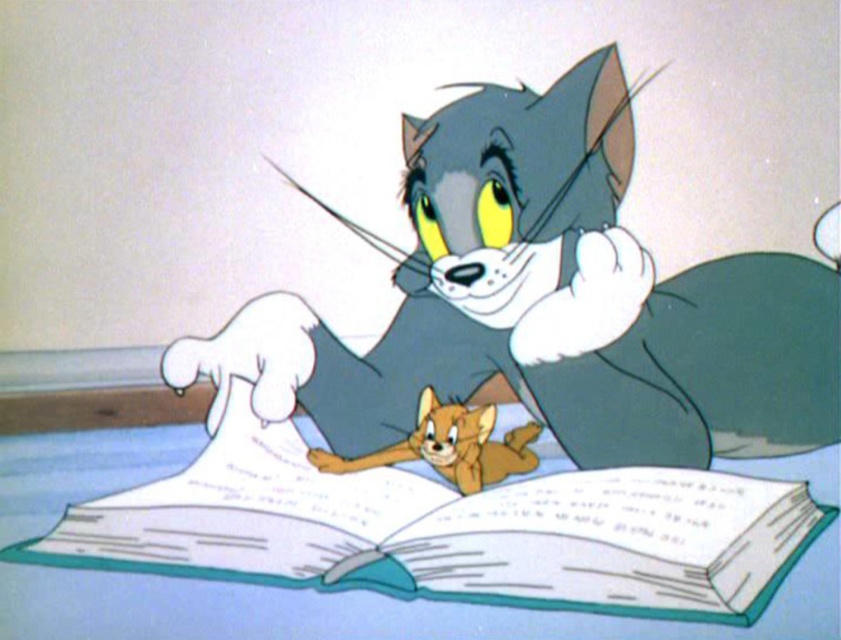
Who is lower down, gray fur cat at center or white paper book at center?

white paper book at center

Is gray fur cat at center smaller than white paper book at center?

Actually, gray fur cat at center might be larger than white paper book at center.

Between point (549, 129) and point (155, 552), which one is positioned in front?

Point (155, 552) is in front.

Where is `gray fur cat at center`? This screenshot has height=640, width=841. gray fur cat at center is located at coordinates (549, 305).

Who is taller, white paper book at center or orange fur cat at center?

white paper book at center is taller.

Can you confirm if white paper book at center is positioned above orange fur cat at center?

Incorrect, white paper book at center is not positioned above orange fur cat at center.

The image size is (841, 640). In order to click on white paper book at center in this screenshot , I will do `click(448, 531)`.

Can you confirm if gray fur cat at center is bigger than orange fur cat at center?

Yes.

The height and width of the screenshot is (640, 841). What do you see at coordinates (549, 305) in the screenshot? I see `gray fur cat at center` at bounding box center [549, 305].

Where is `gray fur cat at center`? The width and height of the screenshot is (841, 640). gray fur cat at center is located at coordinates (549, 305).

Find the location of a particular element. gray fur cat at center is located at coordinates (549, 305).